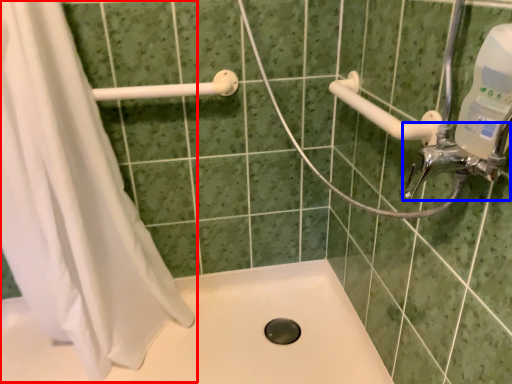
Question: Among these objects, which one is farthest to the camera, shower curtain (highlighted by a red box) or tap (highlighted by a blue box)?

Choices:
 (A) shower curtain
 (B) tap

Answer: (A)